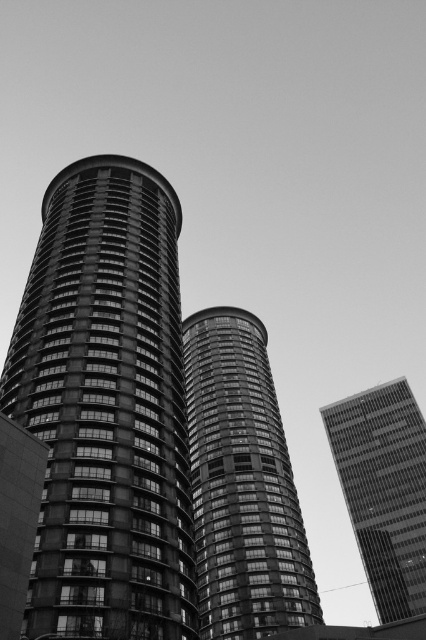
Does smooth glass skyscraper at center have a smaller size compared to smooth glass windows at center?

No, smooth glass skyscraper at center is not smaller than smooth glass windows at center.

Can you confirm if smooth glass skyscraper at center is taller than smooth glass windows at center?

Indeed, smooth glass skyscraper at center has a greater height compared to smooth glass windows at center.

This screenshot has width=426, height=640. Find the location of `smooth glass skyscraper at center`. smooth glass skyscraper at center is located at coordinates (383, 490).

Find the location of `smooth glass skyscraper at center`. smooth glass skyscraper at center is located at coordinates (383, 490).

Which is above, smooth glass tower at center or smooth glass skyscraper at center?

smooth glass tower at center is higher up.

Does smooth glass tower at center appear over smooth glass skyscraper at center?

Yes.

Identify the location of smooth glass tower at center. This screenshot has width=426, height=640. (241, 484).

How far apart are concrete tower at center and smooth glass windows at center?

concrete tower at center is 98.84 feet from smooth glass windows at center.

Is point (129, 250) less distant than point (40, 444)?

No.

Where is `concrete tower at center`? This screenshot has height=640, width=426. concrete tower at center is located at coordinates (106, 408).